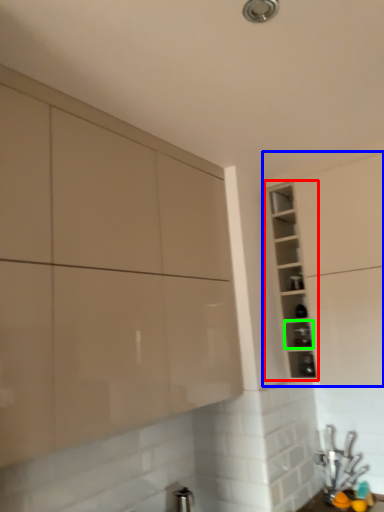
Question: Which object is the farthest from cabinet (highlighted by a red box)? Choose among these: cabinetry (highlighted by a blue box) or shelf (highlighted by a green box).

Choices:
 (A) cabinetry
 (B) shelf

Answer: (B)